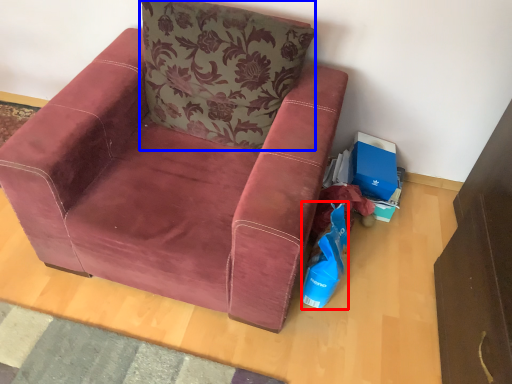
Question: Which of the following is the closest to the observer, shopping bag (highlighted by a red box) or pillow (highlighted by a blue box)?

Choices:
 (A) shopping bag
 (B) pillow

Answer: (B)